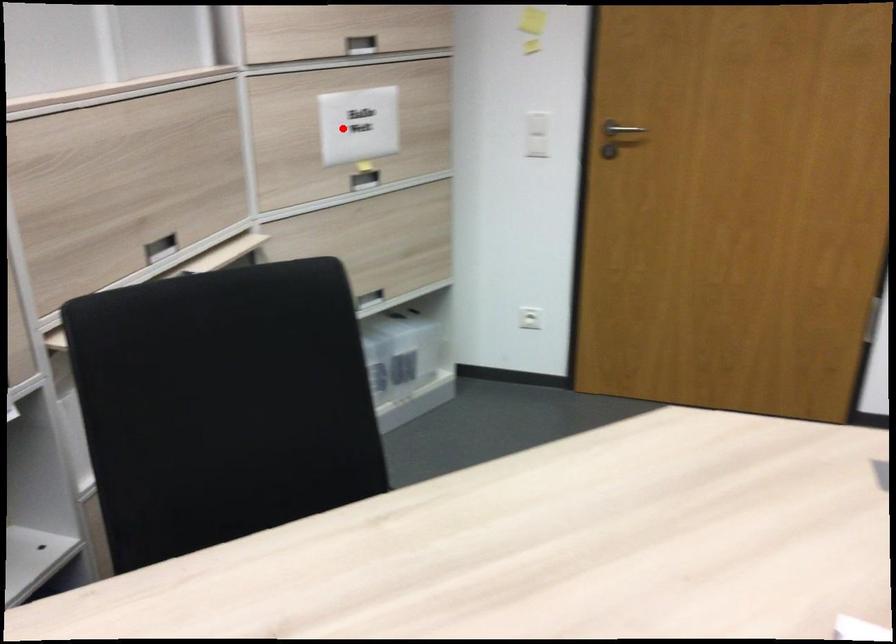
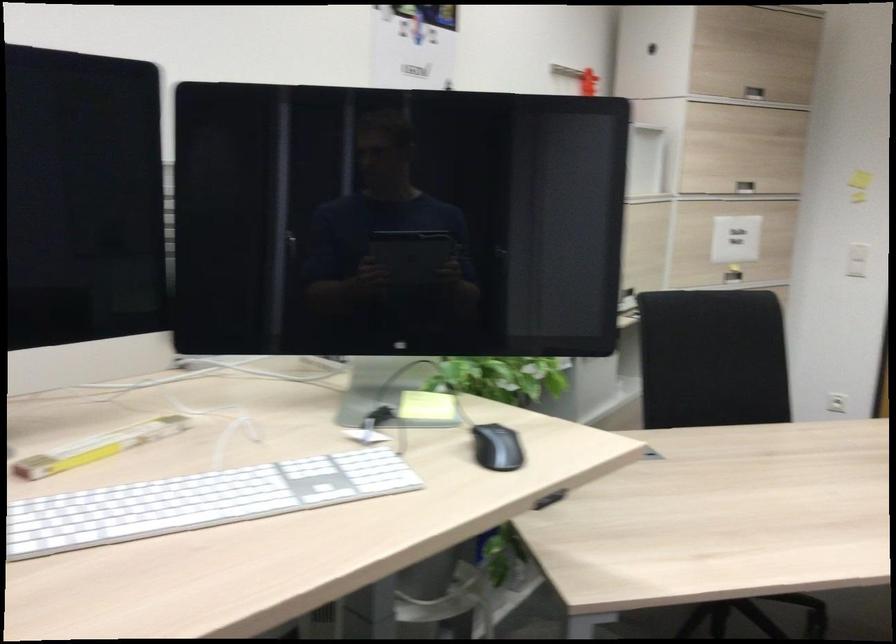
Question: I am providing you with two images of the same scene from different viewpoints. In image1, a red point is highlighted. Considering the same 3D point in image2, which of the following is correct?

Choices:
 (A) It is closer
 (B) It is farther

Answer: (B)